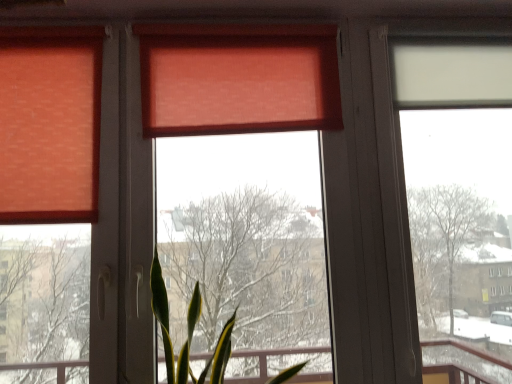
What do you see at coordinates (240, 81) in the screenshot? This screenshot has width=512, height=384. I see `matte orange curtain at upper center` at bounding box center [240, 81].

Locate an element on the screen. This screenshot has width=512, height=384. matte orange window screen at center, which is the second window screen from right to left is located at coordinates (238, 79).

Is matte orange curtain at upper center to the left or to the right of transparent plastic window screen at right, which is the 1th window screen from right to left, in the image?

matte orange curtain at upper center is to the left of transparent plastic window screen at right, which is the 1th window screen from right to left.

Is matte orange curtain at upper center bigger than transparent plastic window screen at right, which is the 1th window screen from right to left?

Indeed, matte orange curtain at upper center has a larger size compared to transparent plastic window screen at right, which is the 1th window screen from right to left.

Is matte orange curtain at upper center oriented towards transparent plastic window screen at right, which is the 1th window screen from right to left?

No, matte orange curtain at upper center is not facing towards transparent plastic window screen at right, which is the 1th window screen from right to left.

Which point is more forward, (17, 39) or (468, 333)?

Positioned in front is point (17, 39).

Is point (272, 45) more distant than point (510, 377)?

That is False.

Is transparent plastic window screen at right, which is the 2th window screen from left to right, surrounded by matte orange window screen at center, which is the second window screen from right to left?

No, transparent plastic window screen at right, which is the 2th window screen from left to right, is not surrounded by matte orange window screen at center, which is the second window screen from right to left.

Is matte orange window screen at center, which is the second window screen from right to left, with transparent plastic window screen at right, which is the 2th window screen from left to right?

There is a gap between matte orange window screen at center, which is the second window screen from right to left, and transparent plastic window screen at right, which is the 2th window screen from left to right.

How distant is matte orange window screen at center, which is the 1th window screen from left to right, from transparent plastic window screen at right, which is the 2th window screen from left to right?

matte orange window screen at center, which is the 1th window screen from left to right, is 8.66 feet from transparent plastic window screen at right, which is the 2th window screen from left to right.

Who is shorter, transparent plastic window screen at right, which is the 2th window screen from left to right, or matte orange window screen at center, which is the 1th window screen from left to right?

transparent plastic window screen at right, which is the 2th window screen from left to right, is shorter.

Looking at their sizes, would you say transparent plastic window screen at right, which is the 1th window screen from right to left, is wider or thinner than matte orange window screen at center, which is the 1th window screen from left to right?

Clearly, transparent plastic window screen at right, which is the 1th window screen from right to left, has less width compared to matte orange window screen at center, which is the 1th window screen from left to right.

Is matte orange curtain at upper center at the left side of matte orange window screen at center, which is the 1th window screen from left to right?

Indeed, matte orange curtain at upper center is positioned on the left side of matte orange window screen at center, which is the 1th window screen from left to right.

From a real-world perspective, who is located lower, matte orange curtain at upper center or matte orange window screen at center, which is the 1th window screen from left to right?

matte orange window screen at center, which is the 1th window screen from left to right.

Is matte orange curtain at upper center oriented towards matte orange window screen at center, which is the 1th window screen from left to right?

Yes, matte orange curtain at upper center is facing matte orange window screen at center, which is the 1th window screen from left to right.

Can you tell me how much matte orange curtain at upper center and matte orange window screen at center, which is the second window screen from right to left, differ in facing direction?

matte orange curtain at upper center and matte orange window screen at center, which is the second window screen from right to left, are facing 0.00663 degrees away from each other.

Could you tell me if transparent plastic window screen at right, which is the 2th window screen from left to right, is facing matte orange curtain at upper center?

No, transparent plastic window screen at right, which is the 2th window screen from left to right, does not turn towards matte orange curtain at upper center.

From the image's perspective, is transparent plastic window screen at right, which is the 1th window screen from right to left, above matte orange curtain at upper center?

No, from the image's perspective, transparent plastic window screen at right, which is the 1th window screen from right to left, is not over matte orange curtain at upper center.

Does point (452, 288) appear closer or farther from the camera than point (160, 56)?

Point (452, 288) is farther from the camera than point (160, 56).

Find the location of a particular element. This screenshot has width=512, height=384. curtain to the left of transparent plastic window screen at right, which is the 1th window screen from right to left is located at coordinates (240, 81).

Visually, is matte orange window screen at center, which is the second window screen from right to left, positioned to the left or to the right of matte orange curtain at upper center?

From the image, it's evident that matte orange window screen at center, which is the second window screen from right to left, is to the right of matte orange curtain at upper center.

Does matte orange window screen at center, which is the second window screen from right to left, turn towards matte orange curtain at upper center?

Yes, matte orange window screen at center, which is the second window screen from right to left, is aimed at matte orange curtain at upper center.

Is matte orange curtain at upper center a part of matte orange window screen at center, which is the second window screen from right to left?

Yes.

In order to click on window screen in front of the matte orange curtain at upper center in this screenshot , I will do `click(238, 79)`.

From a real-world perspective, starting from the matte orange curtain at upper center, which window screen is the 2nd one below it? Please provide its 2D coordinates.

[(458, 183)]

Where is `window screen that is behind the matte orange window screen at center, which is the 1th window screen from left to right`? This screenshot has height=384, width=512. window screen that is behind the matte orange window screen at center, which is the 1th window screen from left to right is located at coordinates (458, 183).

Looking at the image, which one is located further to matte orange window screen at center, which is the second window screen from right to left, transparent plastic window screen at right, which is the 1th window screen from right to left, or matte orange curtain at upper center?

Among the two, transparent plastic window screen at right, which is the 1th window screen from right to left, is located further to matte orange window screen at center, which is the second window screen from right to left.

From the image, which object appears to be nearer to matte orange window screen at center, which is the 1th window screen from left to right, matte orange curtain at upper center or transparent plastic window screen at right, which is the 2th window screen from left to right?

Among the two, matte orange curtain at upper center is located nearer to matte orange window screen at center, which is the 1th window screen from left to right.

Estimate the real-world distances between objects in this image. Which object is further from transparent plastic window screen at right, which is the 2th window screen from left to right, matte orange curtain at upper center or matte orange window screen at center, which is the 1th window screen from left to right?

matte orange curtain at upper center is further to transparent plastic window screen at right, which is the 2th window screen from left to right.

Looking at the image, which one is located closer to matte orange curtain at upper center, matte orange window screen at center, which is the 1th window screen from left to right, or transparent plastic window screen at right, which is the 2th window screen from left to right?

The object closer to matte orange curtain at upper center is matte orange window screen at center, which is the 1th window screen from left to right.

Which object lies nearer to the anchor point matte orange curtain at upper center, transparent plastic window screen at right, which is the 2th window screen from left to right, or matte orange window screen at center, which is the 1th window screen from left to right?

Among the two, matte orange window screen at center, which is the 1th window screen from left to right, is located nearer to matte orange curtain at upper center.

Considering their positions, is matte orange window screen at center, which is the 1th window screen from left to right, positioned closer to transparent plastic window screen at right, which is the 1th window screen from right to left, than matte orange curtain at upper center?

matte orange window screen at center, which is the 1th window screen from left to right.

Locate an element on the screen. This screenshot has width=512, height=384. window screen situated between matte orange curtain at upper center and transparent plastic window screen at right, which is the 1th window screen from right to left, from left to right is located at coordinates (238, 79).